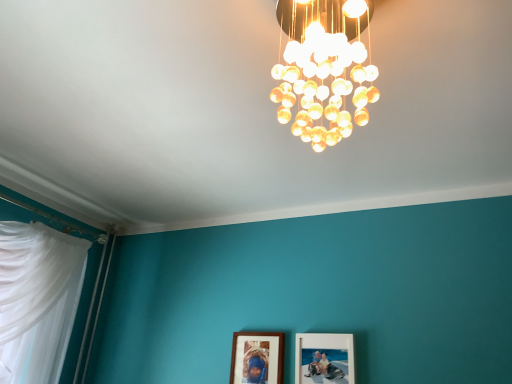
Question: Is translucent glass chandelier at upper center in front of or behind wooden picture frame at center, the first picture frame when ordered from left to right, in the image?

Choices:
 (A) behind
 (B) front

Answer: (B)

Question: Is translucent glass chandelier at upper center wider or thinner than wooden picture frame at center, acting as the 2th picture frame starting from the right?

Choices:
 (A) thin
 (B) wide

Answer: (B)

Question: Estimate the real-world distances between objects in this image. Which object is closer to the wooden picture frame at center, acting as the 2th picture frame starting from the right?

Choices:
 (A) matte wooden picture frame at lower center, which is counted as the first picture frame, starting from the right
 (B) translucent glass chandelier at upper center

Answer: (A)

Question: Which object is the closest to the translucent glass chandelier at upper center?

Choices:
 (A) matte wooden picture frame at lower center, which is counted as the first picture frame, starting from the right
 (B) wooden picture frame at center, the first picture frame when ordered from left to right

Answer: (A)